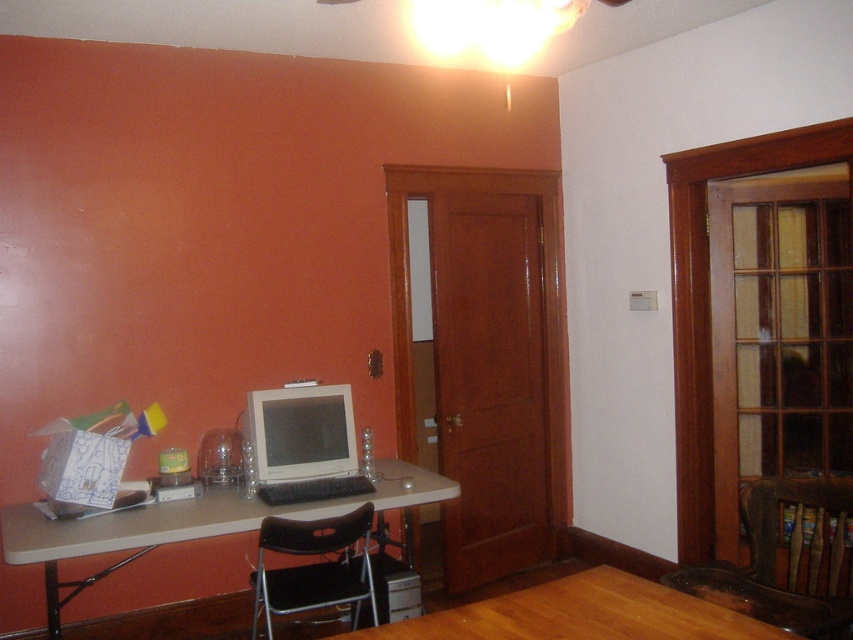
Question: Which of the following is the farthest from the observer?

Choices:
 (A) (625, 636)
 (B) (335, 449)

Answer: (B)

Question: Which object is the farthest from the wooden table at lower center?

Choices:
 (A) black fabric chair at lower center
 (B) brown leather chair at lower right
 (C) matte plastic table at left
 (D) white glossy computer monitor at center

Answer: (D)

Question: From the image, what is the correct spatial relationship of wooden table at lower center in relation to black fabric chair at lower center?

Choices:
 (A) below
 (B) above

Answer: (B)

Question: Based on their relative distances, which object is nearer to the brown leather chair at lower right?

Choices:
 (A) white glossy computer monitor at center
 (B) wooden table at lower center
 (C) matte plastic table at left
 (D) black fabric chair at lower center

Answer: (B)

Question: Can you confirm if wooden table at lower center is bigger than black fabric chair at lower center?

Choices:
 (A) yes
 (B) no

Answer: (B)

Question: Is wooden table at lower center smaller than black fabric chair at lower center?

Choices:
 (A) yes
 (B) no

Answer: (A)